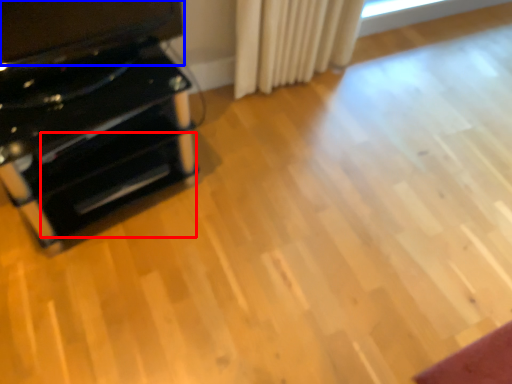
Question: Which object is further to the camera taking this photo, drawer (highlighted by a red box) or wide (highlighted by a blue box)?

Choices:
 (A) drawer
 (B) wide

Answer: (A)